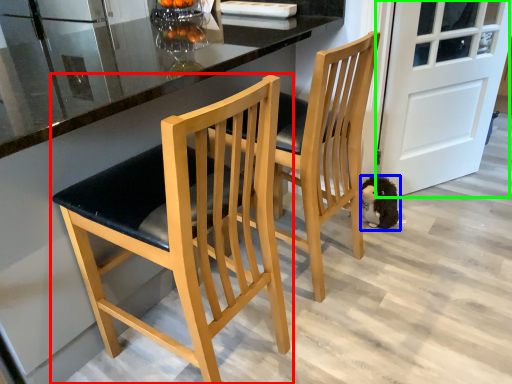
Question: Based on their relative distances, which object is nearer to chair (highlighted by a red box)? Choose from animal (highlighted by a blue box) and door (highlighted by a green box).

Choices:
 (A) animal
 (B) door

Answer: (A)